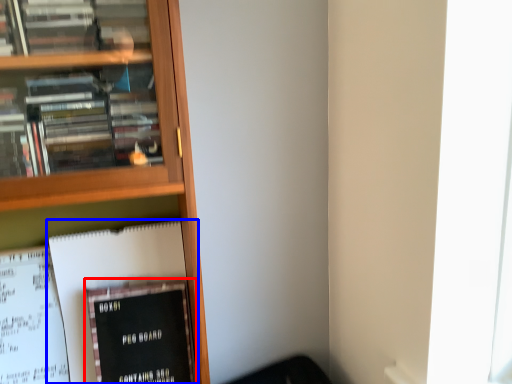
Question: Which object is closer to the camera taking this photo, book (highlighted by a red box) or book (highlighted by a blue box)?

Choices:
 (A) book
 (B) book

Answer: (A)